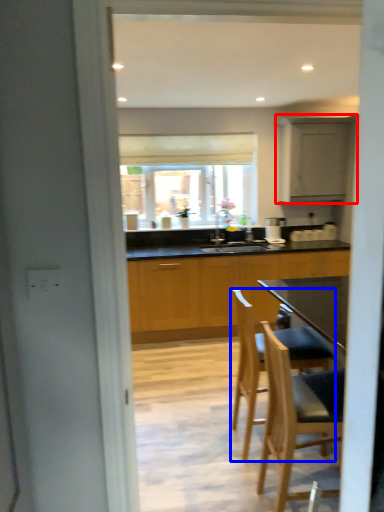
Question: Among these objects, which one is farthest to the camera, cabinetry (highlighted by a red box) or chair (highlighted by a blue box)?

Choices:
 (A) cabinetry
 (B) chair

Answer: (A)